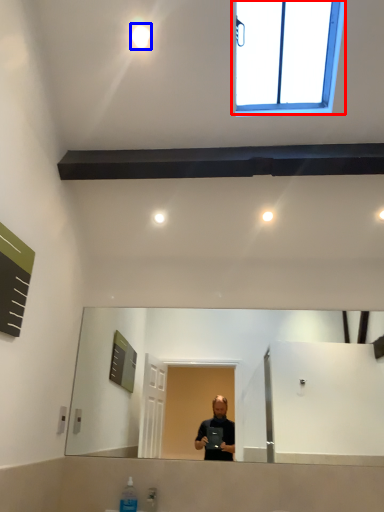
Question: Which of the following is the closest to the observer, window (highlighted by a red box) or lighting (highlighted by a blue box)?

Choices:
 (A) window
 (B) lighting

Answer: (A)